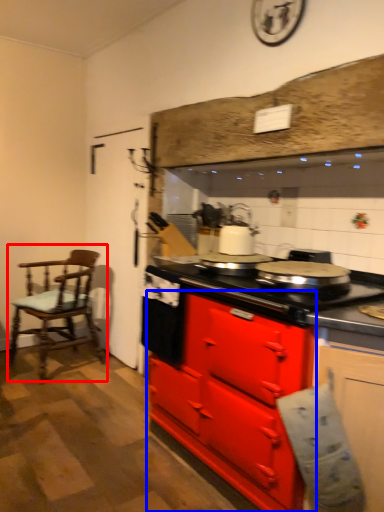
Question: Which object is closer to the camera taking this photo, chair (highlighted by a red box) or cabinetry (highlighted by a blue box)?

Choices:
 (A) chair
 (B) cabinetry

Answer: (B)